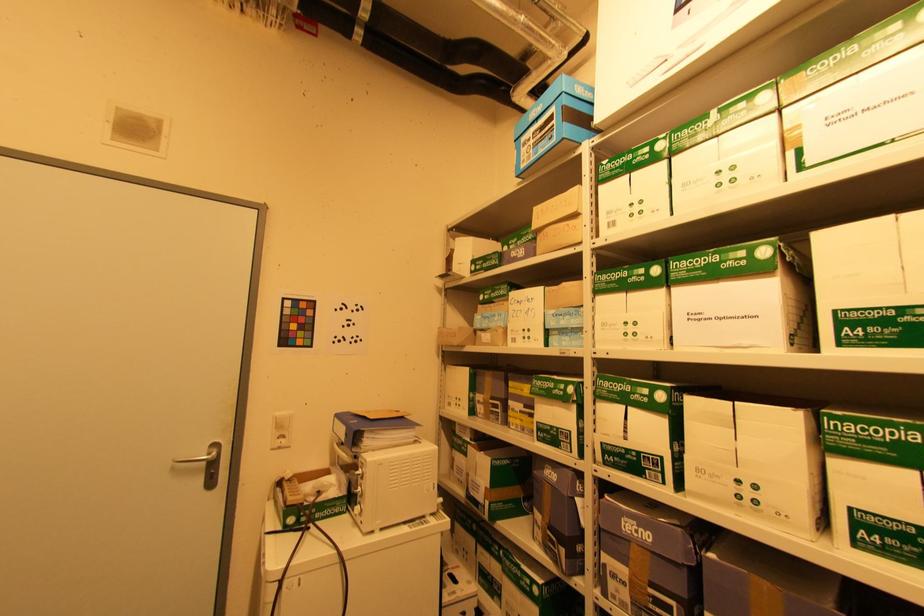
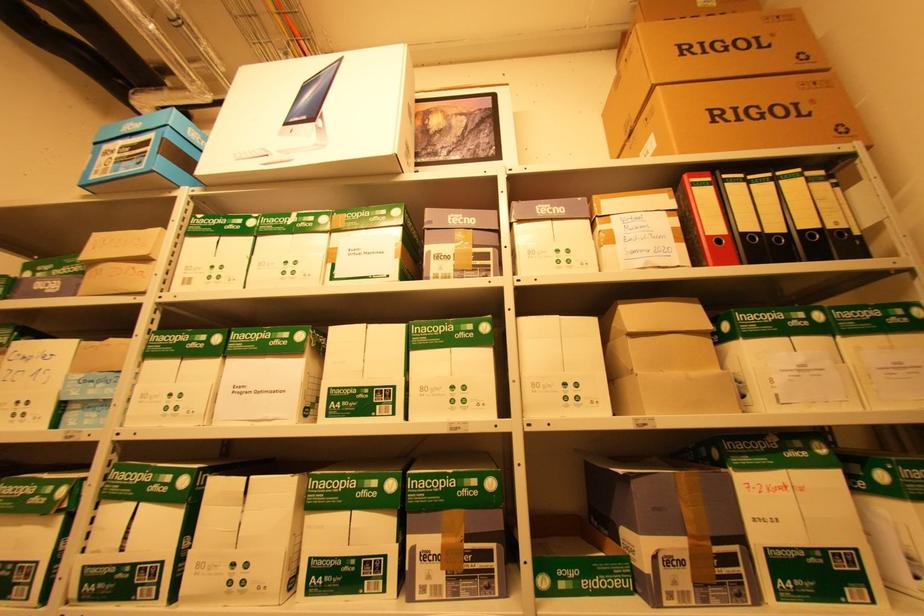
Question: The images are taken continuously from a first-person perspective. In which direction is your viewpoint rotating?

Choices:
 (A) Left
 (B) Right
 (C) Up
 (D) Down

Answer: (B)